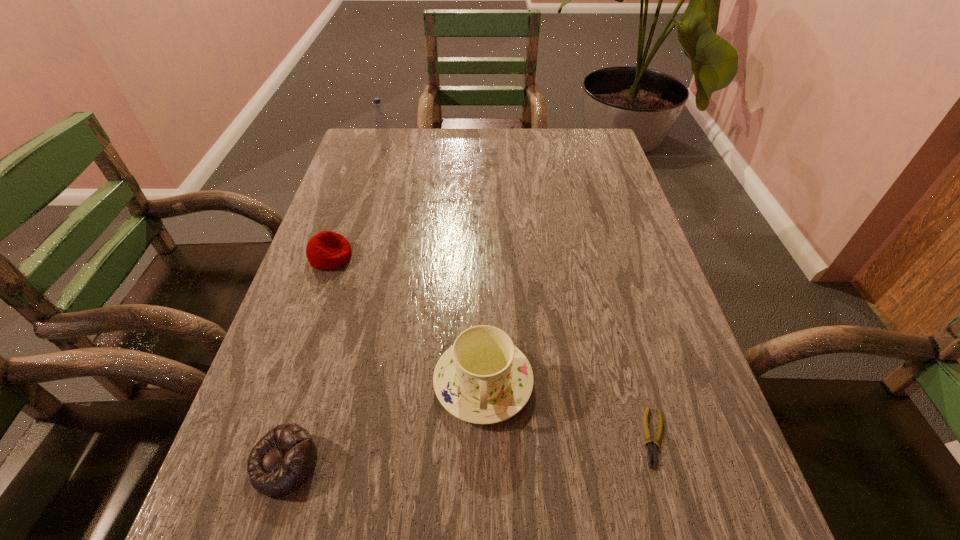
Where is `the third closest object to the rightmost object`? This screenshot has height=540, width=960. the third closest object to the rightmost object is located at coordinates (326, 250).

Locate an element on the screen. The height and width of the screenshot is (540, 960). the second closest object relative to the shorter beanbag is located at coordinates (326, 250).

At what (x,y) coordinates should I click in order to perform the action: click on vacant space that satisfies the following two spatial constraints: 1. on the handle side of the pliers; 2. on the left side of the second object from right to left. Please return your answer as a coordinate pair (x, y). The width and height of the screenshot is (960, 540). Looking at the image, I should click on (484, 438).

At what (x,y) coordinates should I click in order to perform the action: click on free region that satisfies the following two spatial constraints: 1. on the handle side of the fourth shortest object; 2. on the left side of the shortest object. Please return your answer as a coordinate pair (x, y). Looking at the image, I should click on (484, 438).

Identify the location of vacant area in the image that satisfies the following two spatial constraints: 1. on the back side of the nearer beanbag; 2. on the right side of the shortest object. (292, 438).

Identify the location of vacant space that satisfies the following two spatial constraints: 1. on the back side of the fourth tallest object; 2. on the left side of the water bottle. (380, 150).